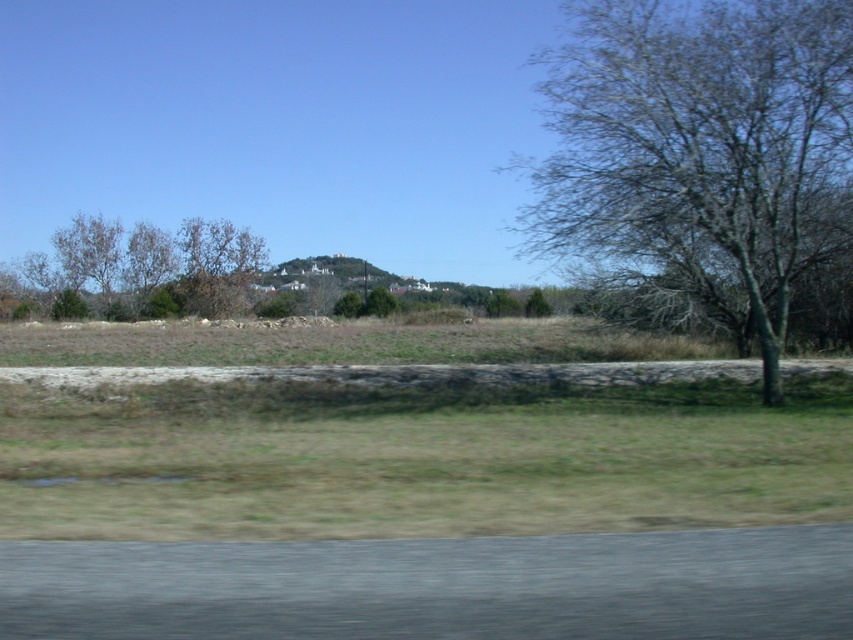
You are a bird seeking a nesting spot. You see a bare wood tree at right and a brown leafless tree at center. Which tree has a trunk that is narrower?

The bare wood tree at right has a narrower trunk than the brown leafless tree at center because it is thinner.

You are a hiker standing on the paved road at the bottom of the image. You want to walk towards the center of the image where you see the brown grass at center and the brown leafless tree at center. Which object will you encounter first?

The brown grass at center will be encountered first because it is closer to the paved road at the bottom than the brown leafless tree at center, which is further away in the middle ground.

Consider the image. You are a hiker standing on the paved road at the bottom of the image. You want to reach the brown grass at center and the bare wood tree at right. Which object is closer to you?

The brown grass at center is closer to you since it is located below the bare wood tree at right, indicating it is positioned lower in the scene and thus nearer to your vantage point on the road.